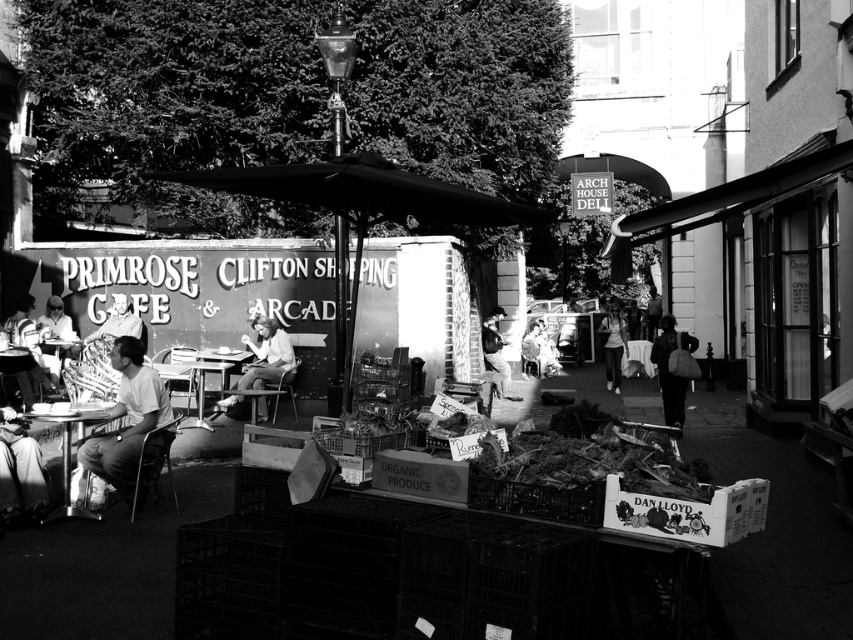
Question: Is matte white shirt at left to the left of metallic silver table at lower left from the viewer's perspective?

Choices:
 (A) yes
 (B) no

Answer: (A)

Question: Is black matte umbrella at center below light gray t-shirt at lower left?

Choices:
 (A) yes
 (B) no

Answer: (B)

Question: Does matte white shirt at left have a smaller size compared to metallic silver table at lower left?

Choices:
 (A) yes
 (B) no

Answer: (B)

Question: Based on their relative distances, which object is farther from the wooden crate at center?

Choices:
 (A) dark fabric bag at center
 (B) light brown leather jacket at center
 (C) light brown fabric jacket at center

Answer: (A)

Question: Considering the real-world distances, which object is farthest from the matte white shirt at center?

Choices:
 (A) wooden crate at center
 (B) metallic silver table at lower left
 (C) metallic silver table at center
 (D) light brown fabric jacket at center

Answer: (A)

Question: Among these objects, which one is farthest from the camera?

Choices:
 (A) dark fabric bag at center
 (B) matte white shirt at left
 (C) wooden crate at center

Answer: (C)